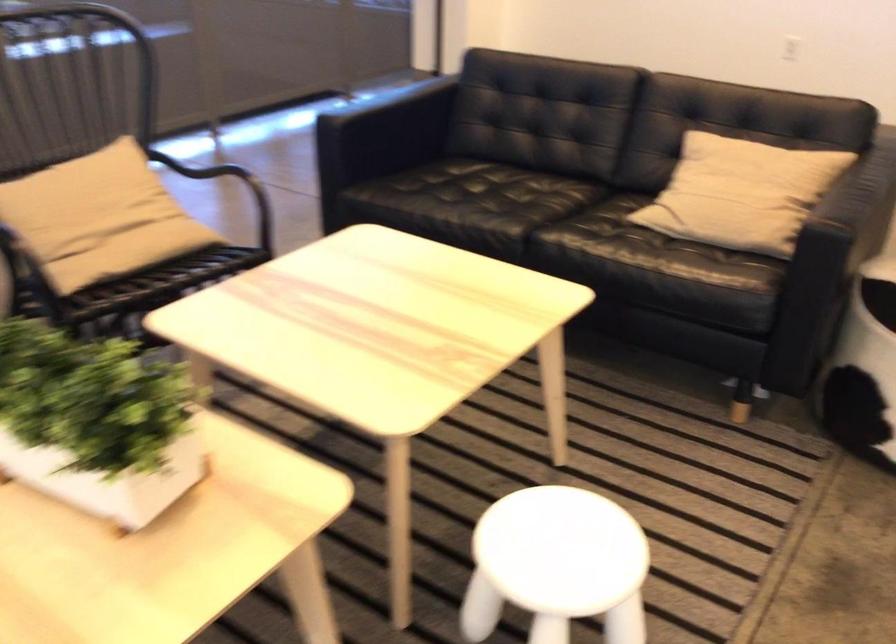
Where would you sit the sofa sitting surface? Please return your answer as a coordinate pair (x, y).

(485, 196)